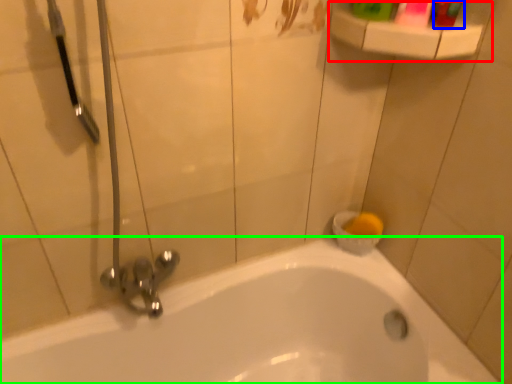
Question: Estimate the real-world distances between objects in this image. Which object is closer to balustrade (highlighted by a red box), toiletry (highlighted by a blue box) or bathtub (highlighted by a green box)?

Choices:
 (A) toiletry
 (B) bathtub

Answer: (A)